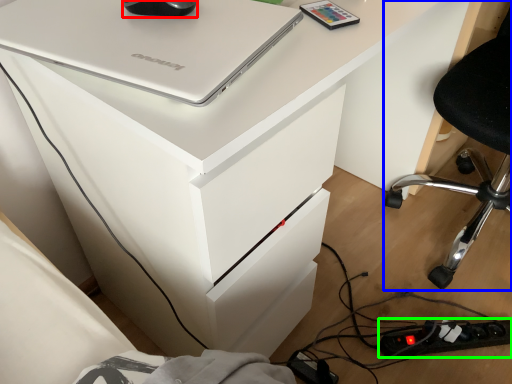
Question: Considering the real-world distances, which object is farthest from mouse (highlighted by a red box)? furniture (highlighted by a blue box) or extension cord (highlighted by a green box)?

Choices:
 (A) furniture
 (B) extension cord

Answer: (A)